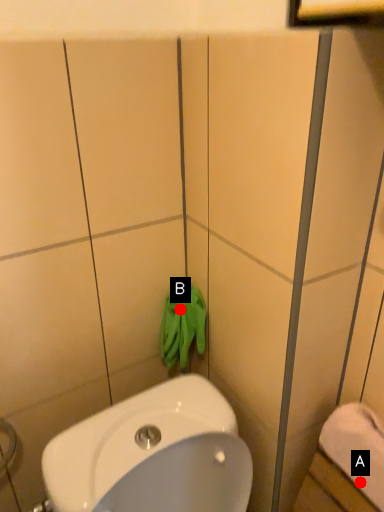
Question: Two points are circled on the image, labeled by A and B beside each circle. Among these points, which one is nearest to the camera?

Choices:
 (A) A is closer
 (B) B is closer

Answer: (A)